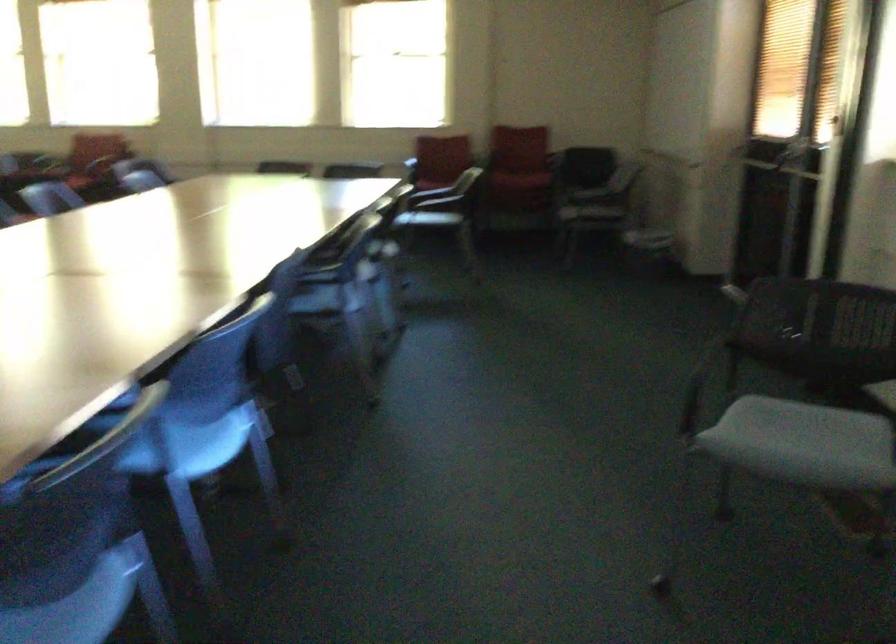
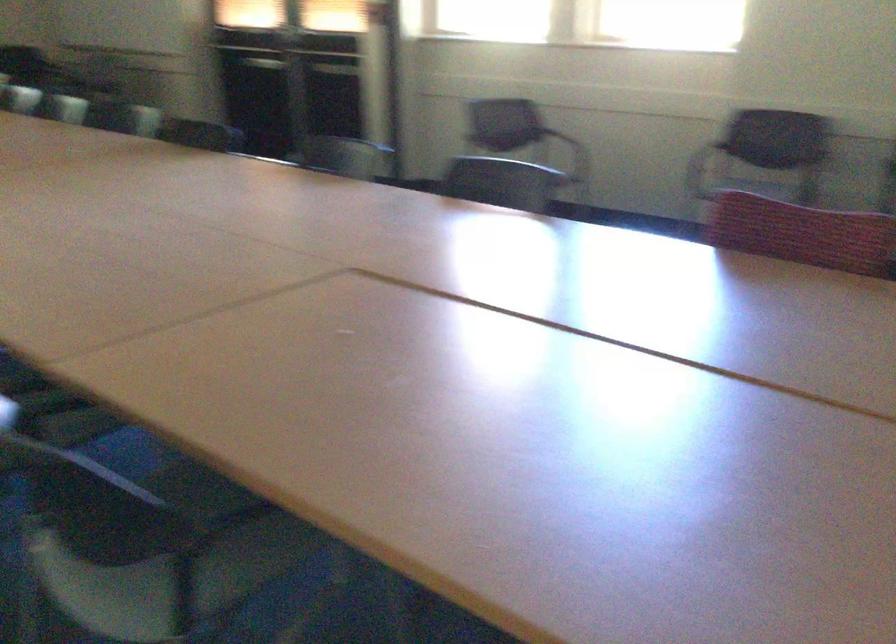
Question: I am providing you with two images of the same scene from different viewpoints. Please identify which objects are invisible in image2.

Choices:
 (A) black chair armrest
 (B) black cylindrical object
 (C) blue chair sitting surface
 (D) black chair sitting surface

Answer: (C)